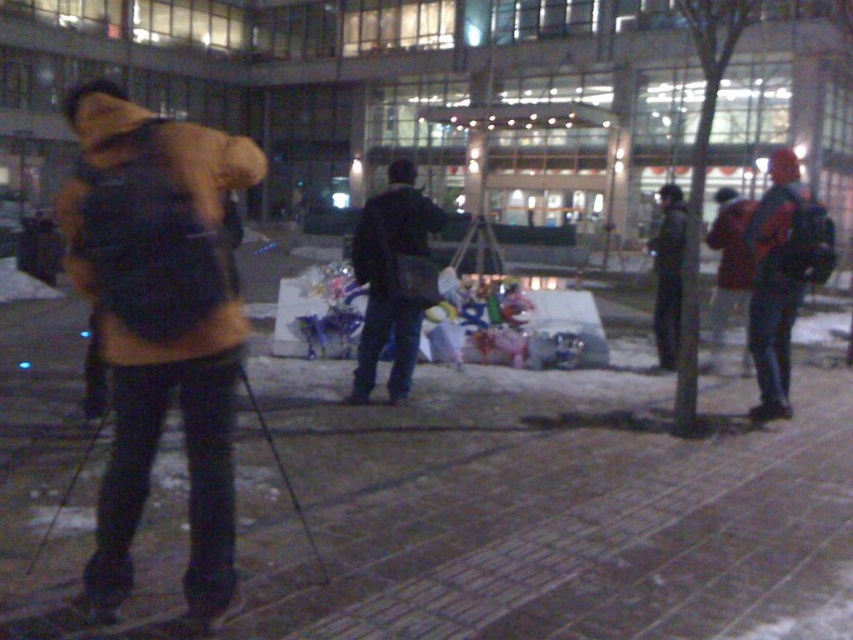
Question: Is dark blue jeans at center further to camera compared to metallic ski pole at center?

Choices:
 (A) no
 (B) yes

Answer: (B)

Question: Does matte yellow jacket at left come behind metallic ski pole at center?

Choices:
 (A) no
 (B) yes

Answer: (A)

Question: Which object appears closest to the camera in this image?

Choices:
 (A) dark blue jeans at center
 (B) matte yellow jacket at left
 (C) metallic ski pole at center

Answer: (B)

Question: Which of the following is the farthest from the observer?

Choices:
 (A) dark blue jeans at center
 (B) matte yellow jacket at left
 (C) metallic ski pole at center

Answer: (A)

Question: Is dark blue jeans at center thinner than metallic ski pole at center?

Choices:
 (A) no
 (B) yes

Answer: (A)

Question: Which of the following is the farthest from the observer?

Choices:
 (A) pos(83,125)
 (B) pos(303,522)
 (C) pos(386,275)

Answer: (C)